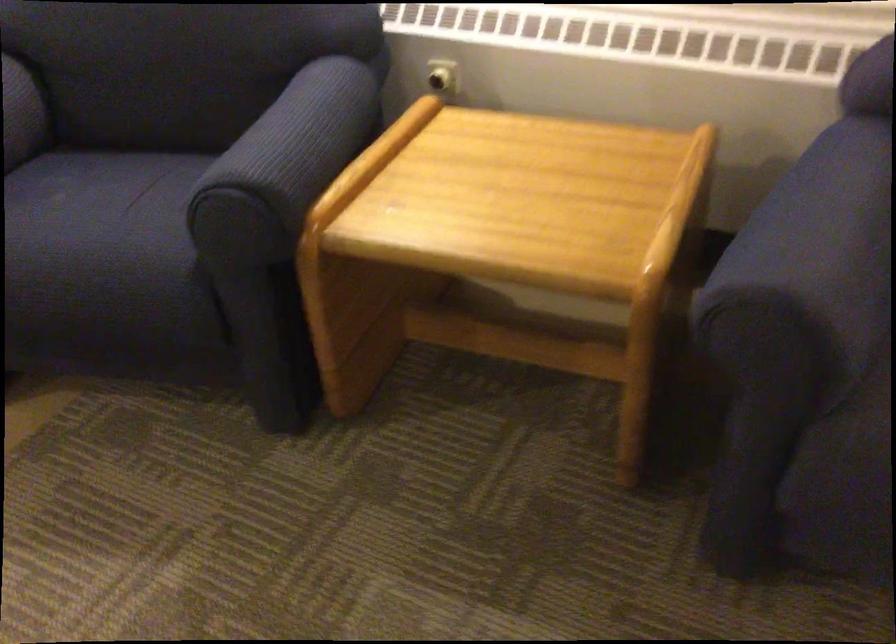
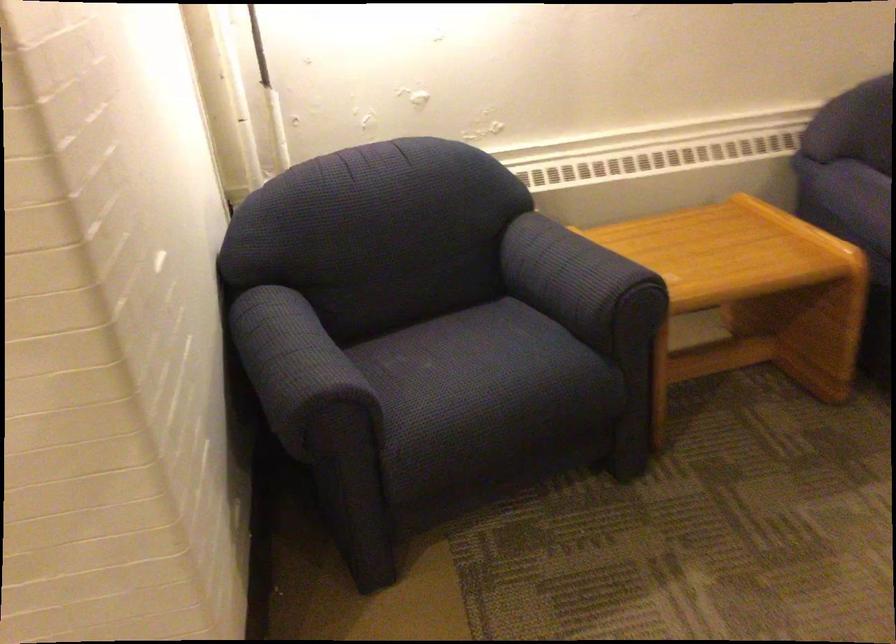
Find the pixel in the second image that matches (222,166) in the first image.

(579, 281)